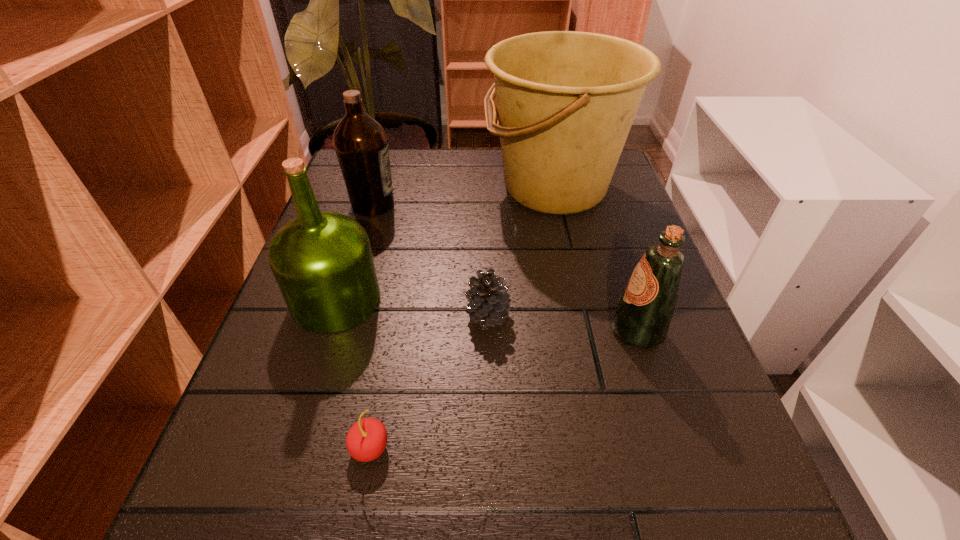
This screenshot has height=540, width=960. Find the location of `object situated at the far left corner`. object situated at the far left corner is located at coordinates (361, 145).

Locate an element on the screen. This screenshot has width=960, height=540. object present at the far right corner is located at coordinates 566,100.

In the image, there is a desktop. Identify the location of free space at the far edge. The image size is (960, 540). (455, 180).

Identify the location of vacant space at the near edge of the desktop. (591, 490).

The height and width of the screenshot is (540, 960). Identify the location of vacant area at the left edge. click(284, 302).

The image size is (960, 540). I want to click on free space at the right edge, so click(x=642, y=414).

Image resolution: width=960 pixels, height=540 pixels. In order to click on vacant point located between the farthest olive oil and the pinecone in this screenshot , I will do `click(431, 260)`.

Locate an element on the screen. The width and height of the screenshot is (960, 540). vacant area between the cherry and the farthest olive oil is located at coordinates (372, 326).

Find the location of `free space between the pinecone and the bucket`. free space between the pinecone and the bucket is located at coordinates (521, 252).

This screenshot has width=960, height=540. In order to click on vacant area that lies between the pinecone and the cherry in this screenshot , I will do `click(429, 381)`.